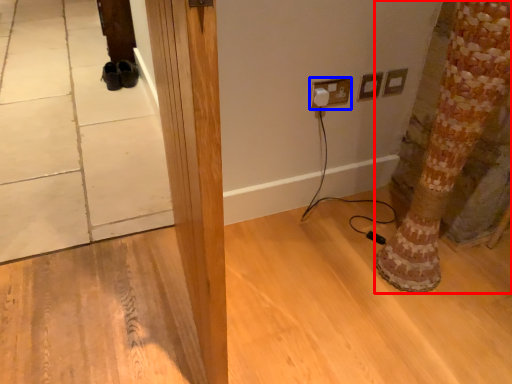
Question: Which point is closer to the camera, tree trunk (highlighted by a red box) or electric outlet (highlighted by a blue box)?

Choices:
 (A) tree trunk
 (B) electric outlet

Answer: (A)